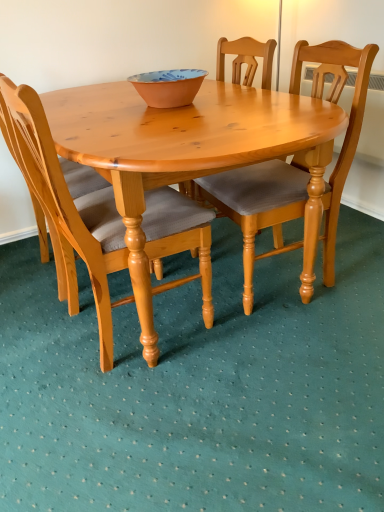
The image size is (384, 512). What do you see at coordinates (260, 206) in the screenshot? I see `light brown wood chair at center, the second chair viewed from the left` at bounding box center [260, 206].

The height and width of the screenshot is (512, 384). Describe the element at coordinates (168, 87) in the screenshot. I see `terracotta ceramic bowl at center` at that location.

What do you see at coordinates (66, 209) in the screenshot?
I see `light wood/texture chair at center, which is the 2th chair from right to left` at bounding box center [66, 209].

At what (x,y) coordinates should I click in order to perform the action: click on light brown wood chair at center, positioned as the first chair in right-to-left order. Please return your answer as a coordinate pair (x, y). Looking at the image, I should click on (260, 206).

Would you consider terracotta ceramic bowl at center to be distant from light brown wood chair at center, the second chair viewed from the left?

No, there isn't a large distance between terracotta ceramic bowl at center and light brown wood chair at center, the second chair viewed from the left.

Is terracotta ceramic bowl at center facing towards light brown wood chair at center, positioned as the first chair in right-to-left order?

No, terracotta ceramic bowl at center is not facing towards light brown wood chair at center, positioned as the first chair in right-to-left order.

Is terracotta ceramic bowl at center surrounding light brown wood chair at center, positioned as the first chair in right-to-left order?

That's incorrect, light brown wood chair at center, positioned as the first chair in right-to-left order, is not inside terracotta ceramic bowl at center.

Which object is wider, light brown wood chair at center, positioned as the first chair in right-to-left order, or light wood/texture chair at center, which is the 1th chair in left-to-right order?

light brown wood chair at center, positioned as the first chair in right-to-left order.

Which is closer, (243, 187) or (95, 254)?

Point (243, 187) is positioned farther from the camera compared to point (95, 254).

Which of these two, light brown wood chair at center, the second chair viewed from the left, or light wood/texture chair at center, which is the 1th chair in left-to-right order, stands taller?

Standing taller between the two is light wood/texture chair at center, which is the 1th chair in left-to-right order.

Between light brown wood chair at center, positioned as the first chair in right-to-left order, and light wood/texture chair at center, which is the 1th chair in left-to-right order, which one appears on the left side from the viewer's perspective?

From the viewer's perspective, light wood/texture chair at center, which is the 1th chair in left-to-right order, appears more on the left side.

Relative to terracotta ceramic bowl at center, is light wood/texture chair at center, which is the 2th chair from right to left, in front or behind?

Clearly, light wood/texture chair at center, which is the 2th chair from right to left, is in front of terracotta ceramic bowl at center.

Based on the photo, are light wood/texture chair at center, which is the 2th chair from right to left, and terracotta ceramic bowl at center far apart?

Actually, light wood/texture chair at center, which is the 2th chair from right to left, and terracotta ceramic bowl at center are a little close together.

From a real-world perspective, is light wood/texture chair at center, which is the 1th chair in left-to-right order, under terracotta ceramic bowl at center?

Yes.

The width and height of the screenshot is (384, 512). I want to click on bowl on the left side of light brown wood chair at center, positioned as the first chair in right-to-left order, so click(168, 87).

How many degrees apart are the facing directions of light brown wood chair at center, the second chair viewed from the left, and terracotta ceramic bowl at center?

They differ by 88.2 degrees in their facing directions.

Is light brown wood chair at center, the second chair viewed from the left, taller than terracotta ceramic bowl at center?

Yes, light brown wood chair at center, the second chair viewed from the left, is taller than terracotta ceramic bowl at center.

Is light brown wood chair at center, positioned as the first chair in right-to-left order, closer to camera compared to terracotta ceramic bowl at center?

Yes, it is.

Is terracotta ceramic bowl at center facing towards light wood/texture chair at center, which is the 2th chair from right to left?

No.

Which object is positioned more to the left, terracotta ceramic bowl at center or light wood/texture chair at center, which is the 1th chair in left-to-right order?

Positioned to the left is light wood/texture chair at center, which is the 1th chair in left-to-right order.

Can you confirm if terracotta ceramic bowl at center is shorter than light wood/texture chair at center, which is the 2th chair from right to left?

Yes, terracotta ceramic bowl at center is shorter than light wood/texture chair at center, which is the 2th chair from right to left.

Which of these two, light wood/texture chair at center, which is the 1th chair in left-to-right order, or light brown wood chair at center, positioned as the first chair in right-to-left order, is bigger?

Bigger between the two is light wood/texture chair at center, which is the 1th chair in left-to-right order.

In the scene shown: From a real-world perspective, does light wood/texture chair at center, which is the 2th chair from right to left, stand above light brown wood chair at center, positioned as the first chair in right-to-left order?

No, from a real-world perspective, light wood/texture chair at center, which is the 2th chair from right to left, is not over light brown wood chair at center, positioned as the first chair in right-to-left order

Which is further, [31,131] or [259,219]?

The point [259,219] is farther from the camera.

Does light wood/texture chair at center, which is the 1th chair in left-to-right order, turn towards light brown wood chair at center, positioned as the first chair in right-to-left order?

Yes, light wood/texture chair at center, which is the 1th chair in left-to-right order, faces towards light brown wood chair at center, positioned as the first chair in right-to-left order.

Which chair is the 1st one when counting from the front of the terracotta ceramic bowl at center? Please provide its 2D coordinates.

[(260, 206)]

This screenshot has width=384, height=512. Identify the location of chair behind the light wood/texture chair at center, which is the 2th chair from right to left. (260, 206).

Which object lies further to the anchor point light wood/texture chair at center, which is the 2th chair from right to left, light brown wood chair at center, the second chair viewed from the left, or terracotta ceramic bowl at center?

terracotta ceramic bowl at center.

Based on their spatial positions, is terracotta ceramic bowl at center or light wood/texture chair at center, which is the 1th chair in left-to-right order, further from light brown wood chair at center, the second chair viewed from the left?

terracotta ceramic bowl at center is positioned further to the anchor light brown wood chair at center, the second chair viewed from the left.

Based on their spatial positions, is terracotta ceramic bowl at center or light brown wood chair at center, positioned as the first chair in right-to-left order, closer to light wood/texture chair at center, which is the 2th chair from right to left?

light brown wood chair at center, positioned as the first chair in right-to-left order, lies closer to light wood/texture chair at center, which is the 2th chair from right to left, than the other object.

Which object lies further to the anchor point light brown wood chair at center, positioned as the first chair in right-to-left order, light wood/texture chair at center, which is the 1th chair in left-to-right order, or terracotta ceramic bowl at center?

Among the two, terracotta ceramic bowl at center is located further to light brown wood chair at center, positioned as the first chair in right-to-left order.

From the image, which object appears to be nearer to terracotta ceramic bowl at center, light brown wood chair at center, the second chair viewed from the left, or light wood/texture chair at center, which is the 1th chair in left-to-right order?

Among the two, light wood/texture chair at center, which is the 1th chair in left-to-right order, is located nearer to terracotta ceramic bowl at center.

Looking at this image, considering their positions, is light wood/texture chair at center, which is the 2th chair from right to left, positioned further to terracotta ceramic bowl at center than light brown wood chair at center, the second chair viewed from the left?

light brown wood chair at center, the second chair viewed from the left, lies further to terracotta ceramic bowl at center than the other object.

At what (x,y) coordinates should I click in order to perform the action: click on bowl between light wood/texture chair at center, which is the 1th chair in left-to-right order, and light brown wood chair at center, positioned as the first chair in right-to-left order, from left to right. Please return your answer as a coordinate pair (x, y). The height and width of the screenshot is (512, 384). Looking at the image, I should click on (168, 87).